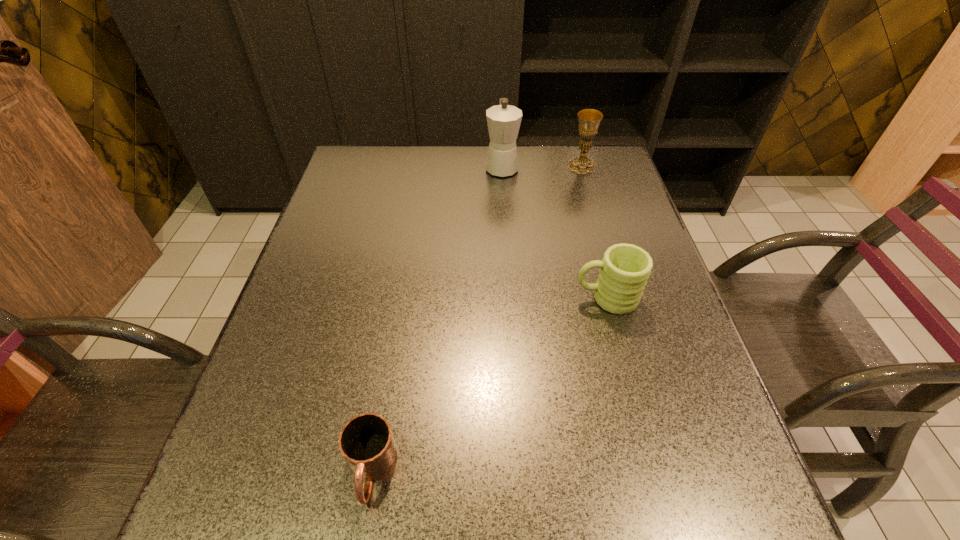
The image size is (960, 540). Identify the location of free space at the left edge of the desktop. (364, 208).

The width and height of the screenshot is (960, 540). I want to click on free space at the right edge of the desktop, so click(x=691, y=334).

At what (x,y) coordinates should I click in order to perform the action: click on vacant space at the far left corner of the desktop. Please return your answer as a coordinate pair (x, y). Looking at the image, I should click on (365, 175).

The width and height of the screenshot is (960, 540). Find the location of `vacant region at the near left corner of the desktop`. vacant region at the near left corner of the desktop is located at coordinates (218, 502).

The height and width of the screenshot is (540, 960). In the image, there is a desktop. What are the coordinates of `free region at the far right corner` in the screenshot? It's located at (581, 151).

I want to click on free spot between the chalice and the tallest object, so click(x=541, y=167).

This screenshot has width=960, height=540. Find the location of `free area in between the chalice and the second object from left to right`. free area in between the chalice and the second object from left to right is located at coordinates (541, 167).

Where is `vacant space in between the shorter mug and the second object from left to right`? The image size is (960, 540). vacant space in between the shorter mug and the second object from left to right is located at coordinates (437, 319).

Locate an element on the screen. free spot between the nearer mug and the third shortest object is located at coordinates (477, 319).

Where is `free space between the nearest object and the second tallest object`? The width and height of the screenshot is (960, 540). free space between the nearest object and the second tallest object is located at coordinates (477, 319).